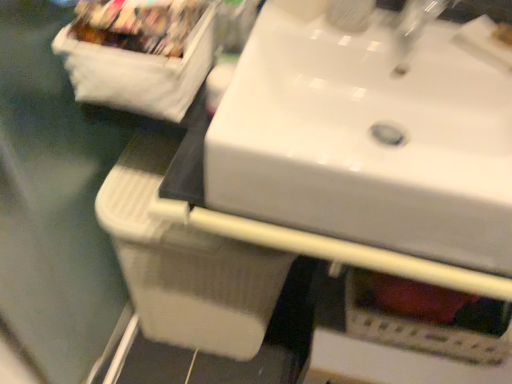
What is the approximate width of white glossy sink at upper center?

16.00 inches.

What is the approximate height of white glossy sink at upper center?

6.28 inches.

Identify the location of white glossy sink at upper center. (368, 132).

Image resolution: width=512 pixels, height=384 pixels. Describe the element at coordinates (368, 132) in the screenshot. I see `white glossy sink at upper center` at that location.

Identify the location of white glossy sink at upper center. (368, 132).